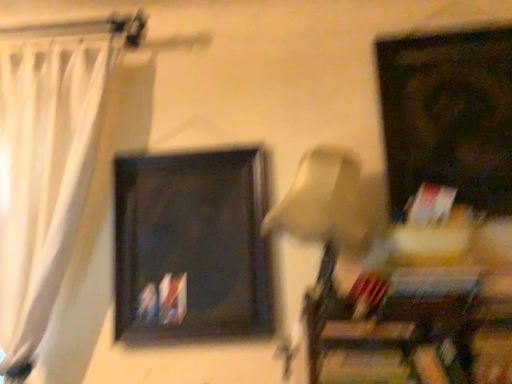
The width and height of the screenshot is (512, 384). Describe the element at coordinates (331, 203) in the screenshot. I see `beige fabric lampshade at center` at that location.

This screenshot has height=384, width=512. What do you see at coordinates (448, 115) in the screenshot? I see `matte black picture frame at upper right, which ranks as the 1th picture frame in right-to-left order` at bounding box center [448, 115].

In the scene shown: In order to face matte black picture frame at center, which is the 2th picture frame in right-to-left order, should I rotate leftwards or rightwards?

Rotate left and turn 8.915 degrees.

Measure the distance between white sheer curtain at left and camera.

white sheer curtain at left and camera are 4.03 feet apart from each other.

The height and width of the screenshot is (384, 512). I want to click on beige fabric lampshade at center, so click(331, 203).

Between beige fabric lampshade at center and matte black picture frame at center, which is the 2th picture frame in right-to-left order, which one has more height?

With more height is matte black picture frame at center, which is the 2th picture frame in right-to-left order.

From the image's perspective, between beige fabric lampshade at center and matte black picture frame at center, which is the 2th picture frame in right-to-left order, which one is located above?

beige fabric lampshade at center.

Which is more to the right, beige fabric lampshade at center or matte black picture frame at center, which is the 2th picture frame in right-to-left order?

Positioned to the right is beige fabric lampshade at center.

Considering the relative sizes of white sheer curtain at left and matte black picture frame at center, which is the 2th picture frame in right-to-left order, in the image provided, is white sheer curtain at left smaller than matte black picture frame at center, which is the 2th picture frame in right-to-left order,?

No, white sheer curtain at left is not smaller than matte black picture frame at center, which is the 2th picture frame in right-to-left order.

Considering the sizes of objects white sheer curtain at left and matte black picture frame at center, which ranks as the 1th picture frame in left-to-right order, in the image provided, who is thinner, white sheer curtain at left or matte black picture frame at center, which ranks as the 1th picture frame in left-to-right order,?

matte black picture frame at center, which ranks as the 1th picture frame in left-to-right order, is thinner.

From the image's perspective, is white sheer curtain at left positioned above or below matte black picture frame at center, which ranks as the 1th picture frame in left-to-right order?

Based on their image positions, white sheer curtain at left is located above matte black picture frame at center, which ranks as the 1th picture frame in left-to-right order.

Can you confirm if matte black picture frame at upper right, which ranks as the 1th picture frame in right-to-left order, is bigger than white sheer curtain at left?

No.

Considering the relative sizes of matte black picture frame at upper right, which appears as the 2th picture frame when viewed from the left, and white sheer curtain at left in the image provided, is matte black picture frame at upper right, which appears as the 2th picture frame when viewed from the left, thinner than white sheer curtain at left?

Correct, the width of matte black picture frame at upper right, which appears as the 2th picture frame when viewed from the left, is less than that of white sheer curtain at left.

Does point (476, 163) come behind point (52, 180)?

That is False.

From a real-world perspective, between matte black picture frame at upper right, which ranks as the 1th picture frame in right-to-left order, and white sheer curtain at left, who is vertically lower?

From a 3D spatial view, white sheer curtain at left is below.

What's the angular difference between beige fabric lampshade at center and white sheer curtain at left's facing directions?

There is a 4.82-degree angle between the facing directions of beige fabric lampshade at center and white sheer curtain at left.

From a real-world perspective, which is physically below, beige fabric lampshade at center or white sheer curtain at left?

beige fabric lampshade at center is physically lower.

Is beige fabric lampshade at center shorter than white sheer curtain at left?

Yes.

Which point is more distant from viewer, [349,201] or [79,66]?

Point [79,66]

Does point (502, 152) appear closer or farther from the camera than point (322, 231)?

Point (502, 152) is farther from the camera than point (322, 231).

Based on their positions, is matte black picture frame at upper right, which appears as the 2th picture frame when viewed from the left, located to the left or right of beige fabric lampshade at center?

In the image, matte black picture frame at upper right, which appears as the 2th picture frame when viewed from the left, appears on the right side of beige fabric lampshade at center.

Based on the photo, from the image's perspective, who appears lower, matte black picture frame at upper right, which appears as the 2th picture frame when viewed from the left, or beige fabric lampshade at center?

beige fabric lampshade at center.

How different are the orientations of matte black picture frame at upper right, which ranks as the 1th picture frame in right-to-left order, and beige fabric lampshade at center in degrees?

2.2 degrees separate the facing orientations of matte black picture frame at upper right, which ranks as the 1th picture frame in right-to-left order, and beige fabric lampshade at center.

Is point (344, 157) positioned before point (469, 191)?

Yes, it is.

From the image's perspective, would you say beige fabric lampshade at center is shown under matte black picture frame at upper right, which appears as the 2th picture frame when viewed from the left?

Indeed, from the image's perspective, beige fabric lampshade at center is shown beneath matte black picture frame at upper right, which appears as the 2th picture frame when viewed from the left.

Could you tell me if beige fabric lampshade at center is facing matte black picture frame at upper right, which ranks as the 1th picture frame in right-to-left order?

No, beige fabric lampshade at center is not facing towards matte black picture frame at upper right, which ranks as the 1th picture frame in right-to-left order.

Is beige fabric lampshade at center inside the boundaries of matte black picture frame at upper right, which appears as the 2th picture frame when viewed from the left, or outside?

The correct answer is: outside.

Is white sheer curtain at left positioned with its back to beige fabric lampshade at center?

That's not correct — white sheer curtain at left is not looking away from beige fabric lampshade at center.

In the scene shown: From the image's perspective, is white sheer curtain at left located beneath beige fabric lampshade at center?

No.

Which object is closer to the camera taking this photo, white sheer curtain at left or beige fabric lampshade at center?

Positioned in front is beige fabric lampshade at center.

Does white sheer curtain at left have a lesser width compared to beige fabric lampshade at center?

Yes.

Find the location of a particular element. The height and width of the screenshot is (384, 512). table lamp in front of the matte black picture frame at center, which ranks as the 1th picture frame in left-to-right order is located at coordinates (331, 203).

Image resolution: width=512 pixels, height=384 pixels. Find the location of `curtain located above the matte black picture frame at center, which ranks as the 1th picture frame in left-to-right order (from the image's perspective)`. curtain located above the matte black picture frame at center, which ranks as the 1th picture frame in left-to-right order (from the image's perspective) is located at coordinates (45, 183).

When comparing their distances from matte black picture frame at center, which is the 2th picture frame in right-to-left order, does beige fabric lampshade at center or white sheer curtain at left seem further?

white sheer curtain at left is further to matte black picture frame at center, which is the 2th picture frame in right-to-left order.

Consider the image. Looking at the image, which one is located further to matte black picture frame at center, which ranks as the 1th picture frame in left-to-right order, beige fabric lampshade at center or matte black picture frame at upper right, which ranks as the 1th picture frame in right-to-left order?

Based on the image, matte black picture frame at upper right, which ranks as the 1th picture frame in right-to-left order, appears to be further to matte black picture frame at center, which ranks as the 1th picture frame in left-to-right order.

Estimate the real-world distances between objects in this image. Which object is further from beige fabric lampshade at center, matte black picture frame at upper right, which ranks as the 1th picture frame in right-to-left order, or white sheer curtain at left?

The object further to beige fabric lampshade at center is white sheer curtain at left.

Considering their positions, is matte black picture frame at upper right, which ranks as the 1th picture frame in right-to-left order, positioned further to matte black picture frame at center, which is the 2th picture frame in right-to-left order, than white sheer curtain at left?

The object further to matte black picture frame at center, which is the 2th picture frame in right-to-left order, is matte black picture frame at upper right, which ranks as the 1th picture frame in right-to-left order.

Which object lies further to the anchor point white sheer curtain at left, matte black picture frame at upper right, which ranks as the 1th picture frame in right-to-left order, or matte black picture frame at center, which is the 2th picture frame in right-to-left order?

matte black picture frame at upper right, which ranks as the 1th picture frame in right-to-left order, is further to white sheer curtain at left.

Based on their spatial positions, is white sheer curtain at left or matte black picture frame at upper right, which appears as the 2th picture frame when viewed from the left, further from matte black picture frame at center, which ranks as the 1th picture frame in left-to-right order?

matte black picture frame at upper right, which appears as the 2th picture frame when viewed from the left, is positioned further to the anchor matte black picture frame at center, which ranks as the 1th picture frame in left-to-right order.

Looking at the image, which one is located closer to matte black picture frame at upper right, which appears as the 2th picture frame when viewed from the left, beige fabric lampshade at center or matte black picture frame at center, which is the 2th picture frame in right-to-left order?

The object closer to matte black picture frame at upper right, which appears as the 2th picture frame when viewed from the left, is beige fabric lampshade at center.

Considering their positions, is beige fabric lampshade at center positioned further to white sheer curtain at left than matte black picture frame at center, which is the 2th picture frame in right-to-left order?

Based on the image, beige fabric lampshade at center appears to be further to white sheer curtain at left.

Locate an element on the screen. picture frame between white sheer curtain at left and matte black picture frame at upper right, which ranks as the 1th picture frame in right-to-left order, from left to right is located at coordinates (192, 247).

Where is `picture frame located between white sheer curtain at left and beige fabric lampshade at center in the left-right direction`? picture frame located between white sheer curtain at left and beige fabric lampshade at center in the left-right direction is located at coordinates (192, 247).

At what (x,y) coordinates should I click in order to perform the action: click on table lamp situated between white sheer curtain at left and matte black picture frame at upper right, which appears as the 2th picture frame when viewed from the left, from left to right. Please return your answer as a coordinate pair (x, y). The image size is (512, 384). Looking at the image, I should click on (331, 203).

Identify the location of table lamp between matte black picture frame at center, which ranks as the 1th picture frame in left-to-right order, and matte black picture frame at upper right, which ranks as the 1th picture frame in right-to-left order. This screenshot has width=512, height=384. (331, 203).